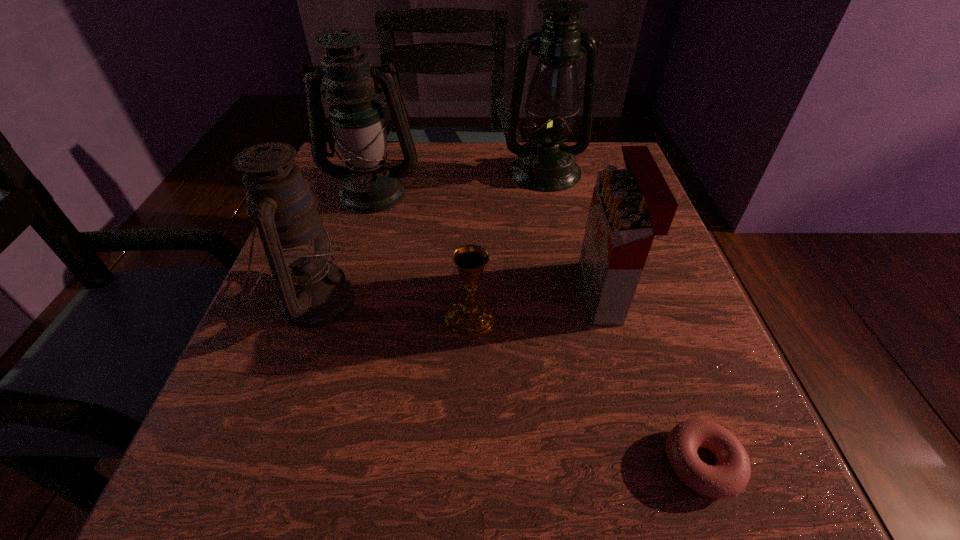
At what (x,y) coordinates should I click in order to perform the action: click on free space located with the lid open on the fourth tallest object. Please return your answer as a coordinate pair (x, y). This screenshot has width=960, height=540. Looking at the image, I should click on (505, 292).

The image size is (960, 540). In order to click on free region located with the lid open on the fourth tallest object in this screenshot , I will do `click(516, 292)`.

Locate an element on the screen. This screenshot has width=960, height=540. vacant region located 0.100m with the lid open on the fourth tallest object is located at coordinates (528, 292).

Where is `vacant space located 0.180m on the back of the chalice`? The height and width of the screenshot is (540, 960). vacant space located 0.180m on the back of the chalice is located at coordinates (472, 232).

Image resolution: width=960 pixels, height=540 pixels. In order to click on free point located on the back of the nearest object in this screenshot , I will do `click(648, 309)`.

In order to click on object situated at the near edge in this screenshot , I will do `click(729, 477)`.

The height and width of the screenshot is (540, 960). In order to click on oil lamp located at the right edge in this screenshot , I will do `click(545, 164)`.

Find the location of a particular element. cigarette case positioned at the right edge is located at coordinates (630, 206).

Find the location of a particular element. doughnut that is positioned at the right edge is located at coordinates (729, 477).

Where is `object located in the far left corner section of the desktop`? This screenshot has height=540, width=960. object located in the far left corner section of the desktop is located at coordinates (369, 185).